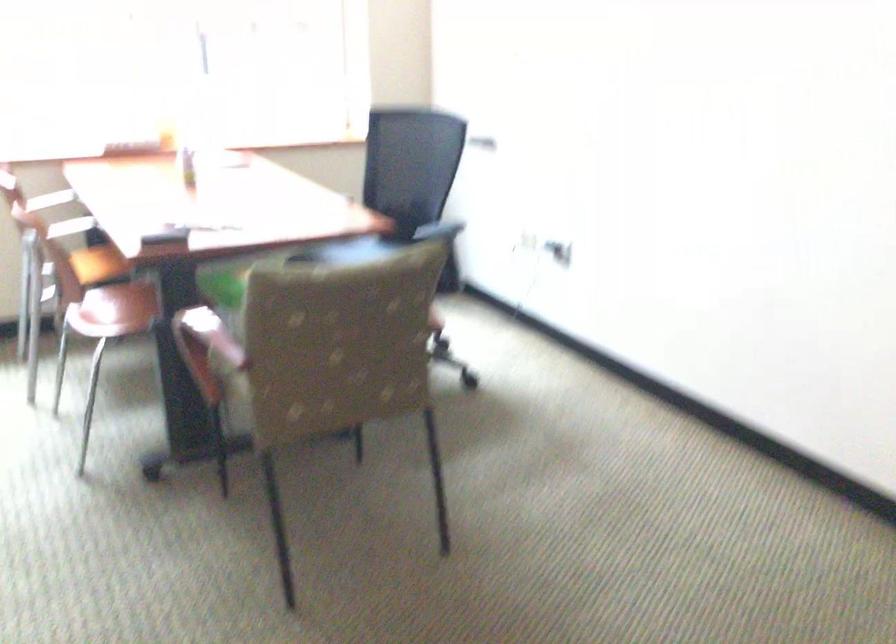
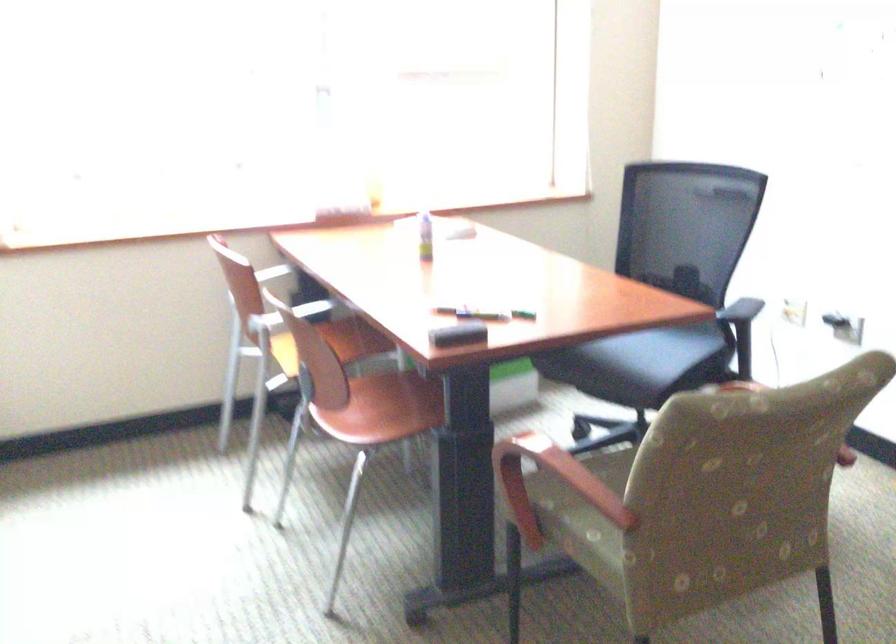
Question: How did the camera likely rotate?

Choices:
 (A) Left
 (B) Right
 (C) Up
 (D) Down

Answer: (A)